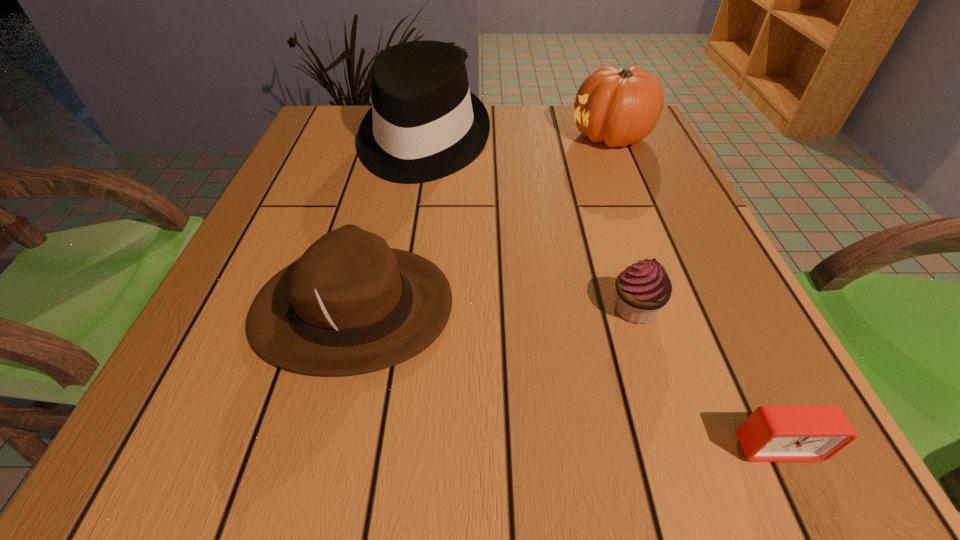
Identify the location of blank region between the shortest object and the pumpkin. The height and width of the screenshot is (540, 960). (694, 291).

Locate an element on the screen. vacant area between the pumpkin and the shorter fedora is located at coordinates (483, 222).

This screenshot has width=960, height=540. I want to click on free space that is in between the pumpkin and the cupcake, so click(x=623, y=223).

At what (x,y) coordinates should I click in order to perform the action: click on blank region between the pumpkin and the nearer fedora. Please return your answer as a coordinate pair (x, y). The height and width of the screenshot is (540, 960). Looking at the image, I should click on (483, 222).

You are a GUI agent. You are given a task and a screenshot of the screen. Output one action in this format:
    pyautogui.click(x=<x>, y=<y>)
    Task: Click on the empty space between the cupcake and the pumpkin
    Image resolution: width=960 pixels, height=540 pixels.
    Given the screenshot: What is the action you would take?
    pyautogui.click(x=623, y=223)

Locate an element on the screen. empty space between the shorter fedora and the fourth tallest object is located at coordinates (494, 308).

Locate an element on the screen. This screenshot has height=540, width=960. object identified as the second closest to the nearer fedora is located at coordinates (644, 288).

Identify the location of the fourth closest object to the pumpkin. (772, 433).